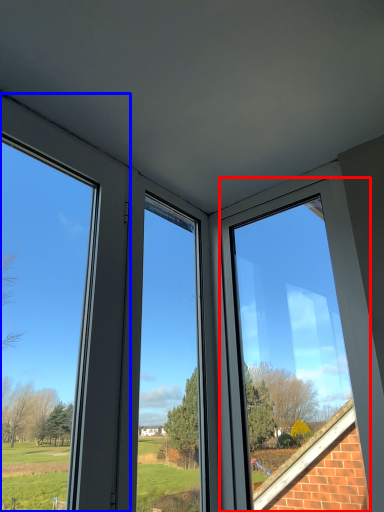
Question: Which point is further to the camera, window (highlighted by a red box) or window (highlighted by a blue box)?

Choices:
 (A) window
 (B) window

Answer: (A)